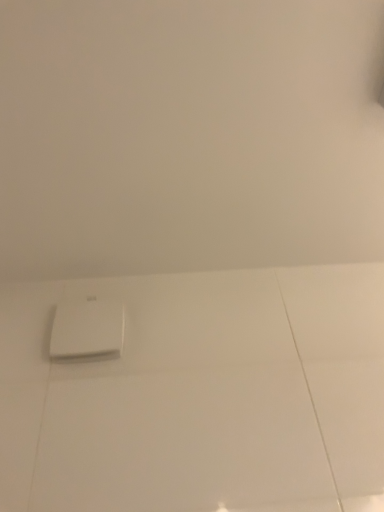
Question: Looking at their shapes, would you say white matte wall at upper center is wider or thinner than white plastic air vent at center?

Choices:
 (A) wide
 (B) thin

Answer: (A)

Question: From the image's perspective, is white matte wall at upper center located above or below white plastic air vent at center?

Choices:
 (A) above
 (B) below

Answer: (A)

Question: Do you think white matte wall at upper center is within white plastic air vent at center, or outside of it?

Choices:
 (A) outside
 (B) inside

Answer: (A)

Question: Would you say white plastic air vent at center is inside or outside white matte wall at upper center?

Choices:
 (A) outside
 (B) inside

Answer: (A)

Question: From the image's perspective, relative to white matte wall at upper center, is white plastic air vent at center above or below?

Choices:
 (A) below
 (B) above

Answer: (A)

Question: Considering the positions of point (104, 344) and point (102, 44), is point (104, 344) closer or farther from the camera than point (102, 44)?

Choices:
 (A) closer
 (B) farther

Answer: (B)

Question: Based on their positions, is white plastic air vent at center located to the left or right of white matte wall at upper center?

Choices:
 (A) right
 (B) left

Answer: (B)